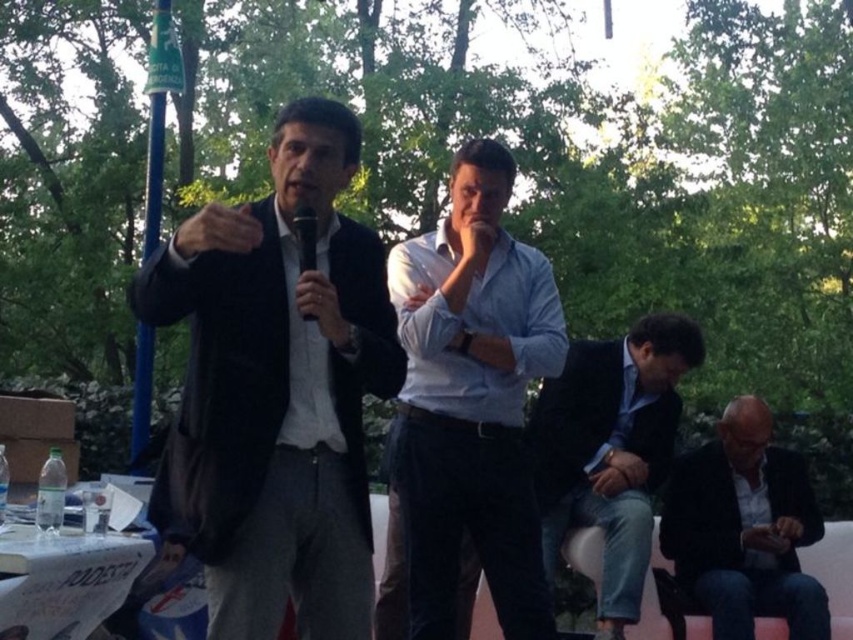
Question: Can you confirm if matte black suit at left is positioned to the right of dark gray suit at lower right?

Choices:
 (A) yes
 (B) no

Answer: (B)

Question: Can you confirm if matte black suit at left is smaller than dark gray suit at lower right?

Choices:
 (A) yes
 (B) no

Answer: (B)

Question: Which of these objects is positioned farthest from the light blue shirt at center?

Choices:
 (A) dark gray suit at lower right
 (B) matte black suit at left
 (C) black matte microphone at center
 (D) dark blue suit at lower right

Answer: (A)

Question: Which of the following is the closest to the observer?

Choices:
 (A) (773, 600)
 (B) (639, 472)
 (C) (305, 268)

Answer: (C)

Question: Does light blue shirt at center lie in front of black matte microphone at center?

Choices:
 (A) yes
 (B) no

Answer: (B)

Question: Which point is farther from the camera taking this photo?

Choices:
 (A) (598, 380)
 (B) (306, 355)
 (C) (479, 557)

Answer: (A)